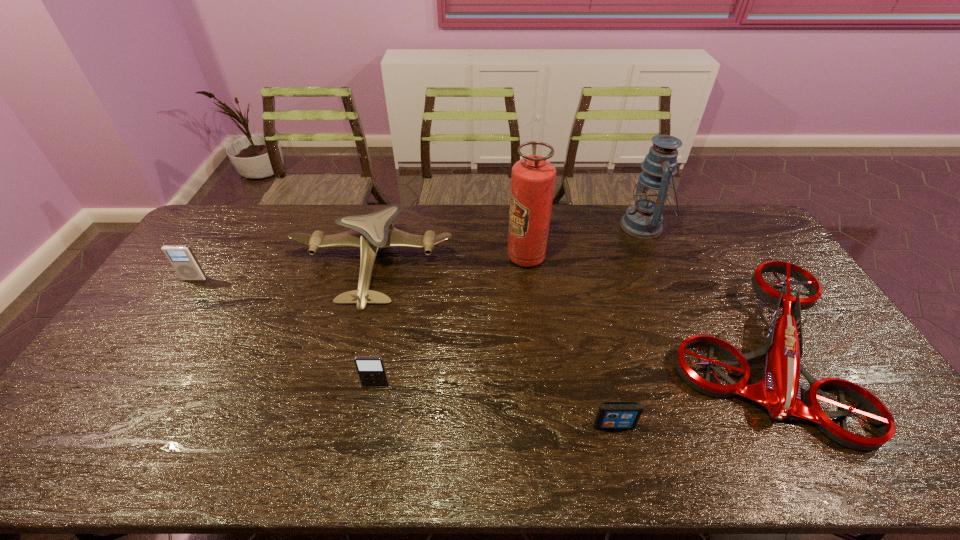
At what (x,y) coordinates should I click in order to perform the action: click on unoccupied area between the second iPod from left to right and the right drone. Please return your answer as a coordinate pair (x, y). Image resolution: width=960 pixels, height=540 pixels. Looking at the image, I should click on (564, 369).

Find the location of a particular element. The image size is (960, 540). empty location between the second shortest iPod and the shortest iPod is located at coordinates (494, 405).

Find the location of `empty space that is in between the right drone and the farthest iPod`. empty space that is in between the right drone and the farthest iPod is located at coordinates (474, 316).

The image size is (960, 540). What are the coordinates of `the second closest object to the lantern` in the screenshot? It's located at (532, 179).

You are a GUI agent. You are given a task and a screenshot of the screen. Output one action in this format:
    pyautogui.click(x=<x>, y=<y>)
    Task: Click on the second closest object to the lantern
    This screenshot has width=960, height=540.
    Given the screenshot: What is the action you would take?
    pyautogui.click(x=532, y=179)

Locate an element on the screen. This screenshot has height=540, width=960. iPod object that ranks as the second closest to the second tallest iPod is located at coordinates (181, 257).

This screenshot has height=540, width=960. I want to click on iPod that is the closest to the second shortest iPod, so click(611, 415).

Find the location of a particular element. The height and width of the screenshot is (540, 960). vacant space that satisfies the following two spatial constraints: 1. on the front-facing side of the lantern; 2. on the front screen of the fifth object from left to right is located at coordinates (731, 426).

This screenshot has height=540, width=960. I want to click on free space that satisfies the following two spatial constraints: 1. on the label side of the fire extinguisher; 2. on the right side of the right drone, so click(x=537, y=353).

This screenshot has width=960, height=540. In order to click on free spot that satisfies the following two spatial constraints: 1. on the label side of the fire extinguisher; 2. on the front-facing side of the leftmost object in this screenshot , I will do `click(529, 279)`.